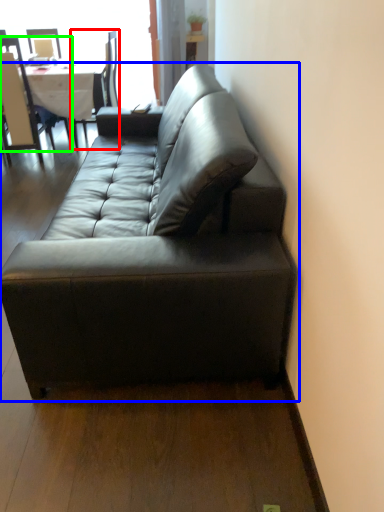
Question: Which is nearer to the chair (highlighted by a red box)? studio couch (highlighted by a blue box) or chair (highlighted by a green box).

Choices:
 (A) studio couch
 (B) chair

Answer: (B)